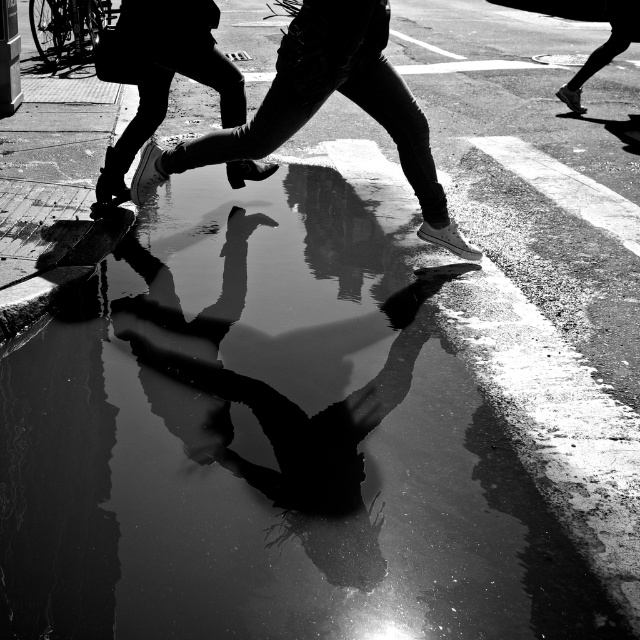
Does point (227, 150) lie behind point (218, 19)?

No, it is in front of (218, 19).

Where is `smooth leather shoe at center`? This screenshot has width=640, height=640. smooth leather shoe at center is located at coordinates [x=321, y=104].

The height and width of the screenshot is (640, 640). Describe the element at coordinates (321, 104) in the screenshot. I see `smooth leather shoe at center` at that location.

Identify the location of smooth leather shoe at center. This screenshot has width=640, height=640. (321, 104).